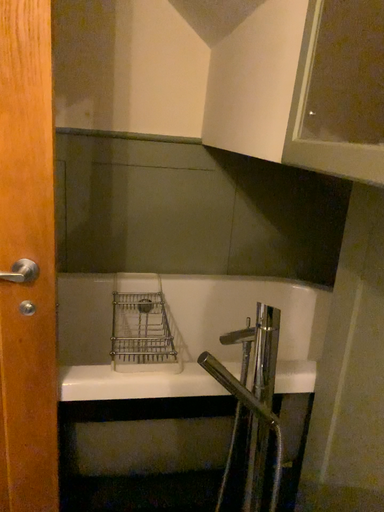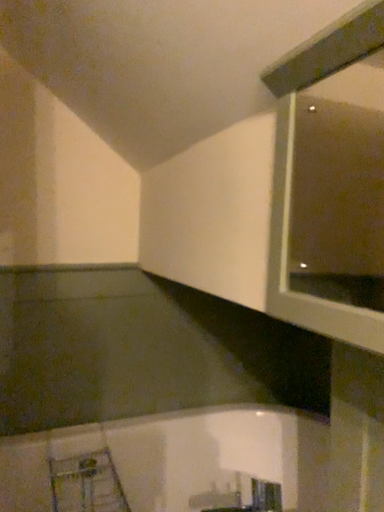
Question: How did the camera likely rotate when shooting the video?

Choices:
 (A) rotated left
 (B) rotated right

Answer: (B)